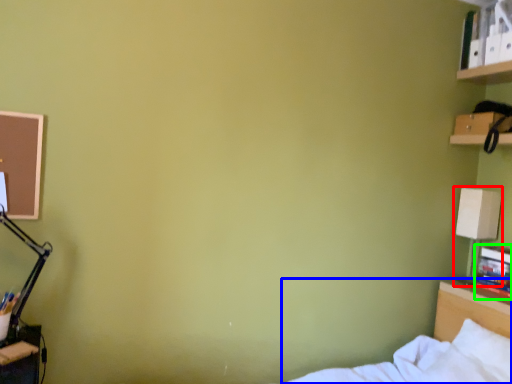
Question: Based on their relative distances, which object is nearer to table lamp (highlighted by a red box)? Choose from bed (highlighted by a blue box) and book (highlighted by a green box).

Choices:
 (A) bed
 (B) book

Answer: (B)